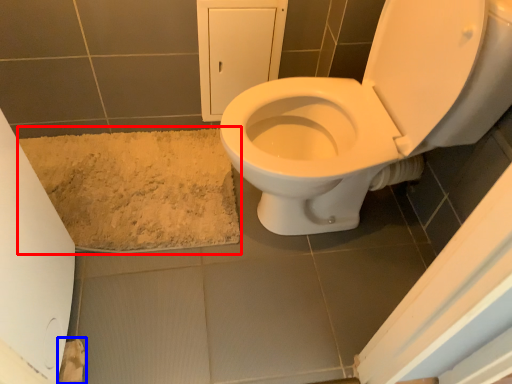
Question: Which object appears closest to the camera in this image, bath mat (highlighted by a red box) or toilet paper (highlighted by a blue box)?

Choices:
 (A) bath mat
 (B) toilet paper

Answer: (B)